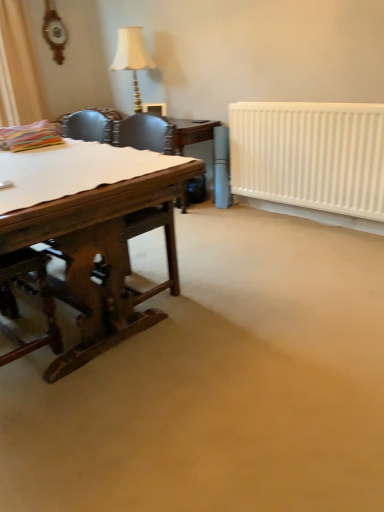
Question: Considering the relative sizes of white matte radiator at right and matte gold lamp at upper center in the image provided, is white matte radiator at right smaller than matte gold lamp at upper center?

Choices:
 (A) no
 (B) yes

Answer: (A)

Question: Is white matte radiator at right next to matte gold lamp at upper center and touching it?

Choices:
 (A) yes
 (B) no

Answer: (B)

Question: Is white matte radiator at right far from matte gold lamp at upper center?

Choices:
 (A) no
 (B) yes

Answer: (B)

Question: Is white matte radiator at right to the right of matte gold lamp at upper center from the viewer's perspective?

Choices:
 (A) no
 (B) yes

Answer: (B)

Question: From the image's perspective, is white matte radiator at right on top of matte gold lamp at upper center?

Choices:
 (A) no
 (B) yes

Answer: (A)

Question: Is white matte radiator at right shorter than matte gold lamp at upper center?

Choices:
 (A) yes
 (B) no

Answer: (A)

Question: Is matte gold lamp at upper center wider than white paper at left?

Choices:
 (A) yes
 (B) no

Answer: (B)

Question: Can you confirm if matte gold lamp at upper center is positioned to the right of white paper at left?

Choices:
 (A) yes
 (B) no

Answer: (A)

Question: Is the depth of matte gold lamp at upper center greater than that of white paper at left?

Choices:
 (A) no
 (B) yes

Answer: (B)

Question: Can you confirm if matte gold lamp at upper center is positioned to the left of white paper at left?

Choices:
 (A) yes
 (B) no

Answer: (B)

Question: Does matte gold lamp at upper center have a lesser height compared to white paper at left?

Choices:
 (A) no
 (B) yes

Answer: (A)

Question: Could you tell me if matte gold lamp at upper center is facing white paper at left?

Choices:
 (A) yes
 (B) no

Answer: (B)

Question: Is white paper at left smaller than matte gold lamp at upper center?

Choices:
 (A) yes
 (B) no

Answer: (A)